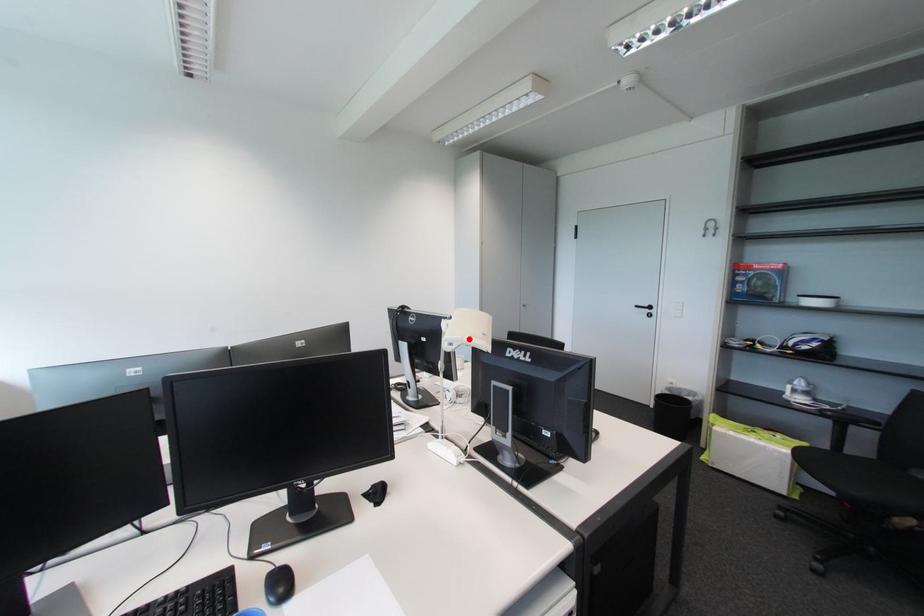
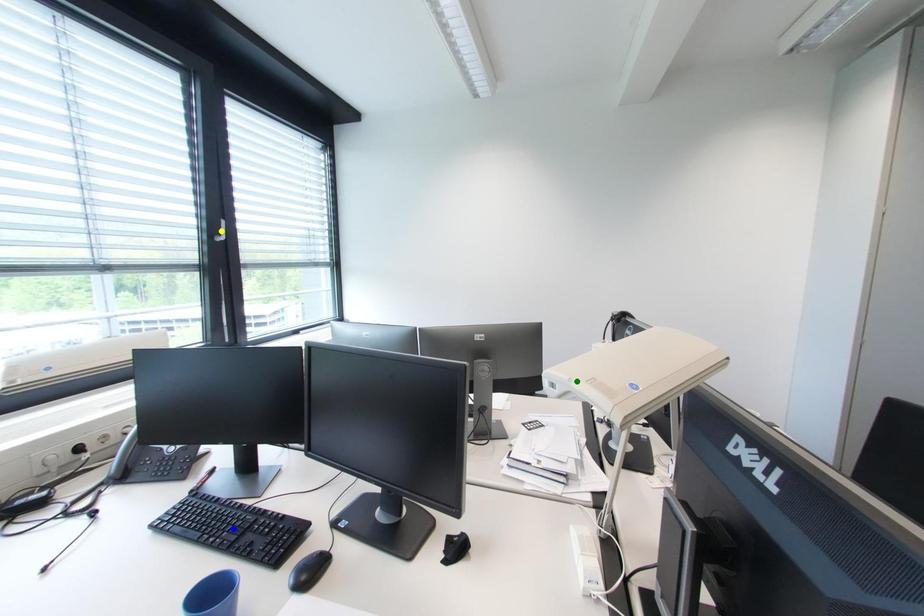
Question: I am providing you with two images of the same scene from different viewpoints. A red point is marked on the first image. You are given multiple points on the second image. Which mark in image 2 goes with the point in image 1?

Choices:
 (A) green point
 (B) yellow point
 (C) blue point

Answer: (A)